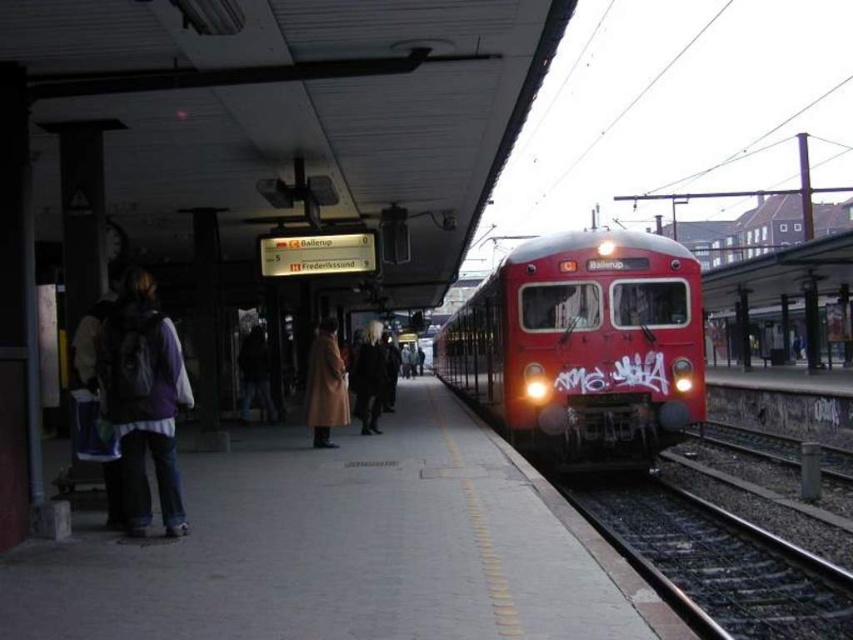
Can you confirm if light brown leather coat at center is positioned to the right of dark brown leather coat at center?

Yes, light brown leather coat at center is to the right of dark brown leather coat at center.

Can you confirm if light brown leather coat at center is shorter than dark brown leather coat at center?

Correct, light brown leather coat at center is not as tall as dark brown leather coat at center.

This screenshot has height=640, width=853. I want to click on light brown leather coat at center, so click(x=325, y=385).

Can you confirm if concrete platform at center is positioned to the right of red glossy train at center?

No, concrete platform at center is not to the right of red glossy train at center.

Does concrete platform at center have a larger size compared to red glossy train at center?

Actually, concrete platform at center might be smaller than red glossy train at center.

Is point (364, 636) closer to viewer compared to point (511, 369)?

That is True.

The height and width of the screenshot is (640, 853). In order to click on concrete platform at center in this screenshot , I will do `click(346, 548)`.

Is point (660, 432) farther from viewer compared to point (339, 371)?

No.

What do you see at coordinates (583, 348) in the screenshot? I see `red glossy train at center` at bounding box center [583, 348].

This screenshot has width=853, height=640. What are the coordinates of `red glossy train at center` in the screenshot? It's located at (583, 348).